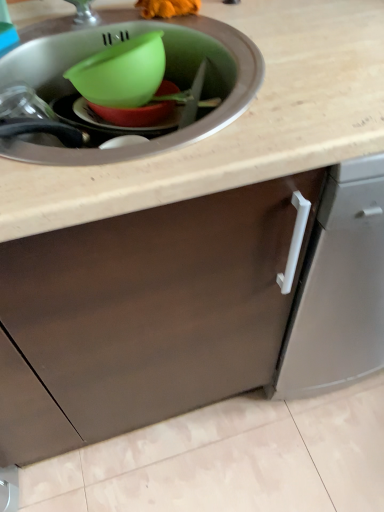
Describe the element at coordinates (135, 114) in the screenshot. I see `green plastic bowl at center` at that location.

Locate an element on the screen. This screenshot has width=384, height=512. green plastic bowl at center is located at coordinates (135, 114).

Find the location of a particular element. The height and width of the screenshot is (512, 384). matte green plastic sink at upper left is located at coordinates (166, 76).

In order to face matte green plastic sink at upper left, should I rotate leftwards or rightwards?

Rotate your view left by about 9.025°.

What do you see at coordinates (166, 76) in the screenshot? I see `matte green plastic sink at upper left` at bounding box center [166, 76].

Identify the location of green plastic bowl at center. The width and height of the screenshot is (384, 512). (135, 114).

Can you confirm if green plastic bowl at center is positioned to the left of matte green plastic sink at upper left?

No.

In the scene shown: Which object is closer to the camera taking this photo, green plastic bowl at center or matte green plastic sink at upper left?

Positioned in front is matte green plastic sink at upper left.

Does point (164, 93) come farther from viewer compared to point (28, 38)?

Yes, point (164, 93) is behind point (28, 38).

From the image's perspective, between green plastic bowl at center and matte green plastic sink at upper left, which one is located above?

From the image's view, green plastic bowl at center is above.

From a real-world perspective, is green plastic bowl at center located beneath matte green plastic sink at upper left?

Yes, from a real-world perspective, green plastic bowl at center is under matte green plastic sink at upper left.

Is green plastic bowl at center wider than matte green plastic sink at upper left?

No.

Who is taller, green plastic bowl at center or matte green plastic sink at upper left?

matte green plastic sink at upper left is taller.

Considering the sizes of objects green plastic bowl at center and matte green plastic sink at upper left in the image provided, who is bigger, green plastic bowl at center or matte green plastic sink at upper left?

Bigger between the two is matte green plastic sink at upper left.

Can we say green plastic bowl at center lies outside matte green plastic sink at upper left?

Actually, green plastic bowl at center is at least partially inside matte green plastic sink at upper left.

In the scene shown: Is green plastic bowl at center next to matte green plastic sink at upper left?

No, green plastic bowl at center is not in contact with matte green plastic sink at upper left.

Is matte green plastic sink at upper left at the back of green plastic bowl at center?

Yes, green plastic bowl at center's orientation is away from matte green plastic sink at upper left.

Measure the distance between green plastic bowl at center and matte green plastic sink at upper left.

green plastic bowl at center and matte green plastic sink at upper left are 15.02 centimeters apart.

Locate an element on the screen. basin located on the right of matte green plastic sink at upper left is located at coordinates (135, 114).

Between matte green plastic sink at upper left and green plastic bowl at center, which one appears on the right side from the viewer's perspective?

green plastic bowl at center is more to the right.

Is the depth of matte green plastic sink at upper left less than that of green plastic bowl at center?

Yes, it is in front of green plastic bowl at center.

Considering the positions of points (211, 88) and (146, 124), is point (211, 88) closer to camera compared to point (146, 124)?

That is False.

From the image's perspective, is matte green plastic sink at upper left on top of green plastic bowl at center?

Actually, matte green plastic sink at upper left appears below green plastic bowl at center in the image.

From a real-world perspective, who is located lower, matte green plastic sink at upper left or green plastic bowl at center?

green plastic bowl at center, from a real-world perspective.

Considering the sizes of objects matte green plastic sink at upper left and green plastic bowl at center in the image provided, who is thinner, matte green plastic sink at upper left or green plastic bowl at center?

Thinner between the two is green plastic bowl at center.

Is matte green plastic sink at upper left taller than green plastic bowl at center?

Correct, matte green plastic sink at upper left is much taller as green plastic bowl at center.

Who is bigger, matte green plastic sink at upper left or green plastic bowl at center?

matte green plastic sink at upper left is bigger.

Would you say green plastic bowl at center is part of matte green plastic sink at upper left's contents?

That's correct, green plastic bowl at center is inside matte green plastic sink at upper left.

Is matte green plastic sink at upper left not close to green plastic bowl at center?

No, matte green plastic sink at upper left is in close proximity to green plastic bowl at center.

Is green plastic bowl at center at the back of matte green plastic sink at upper left?

matte green plastic sink at upper left does not have its back to green plastic bowl at center.

Can you tell me how much matte green plastic sink at upper left and green plastic bowl at center differ in facing direction?

The angle between the facing direction of matte green plastic sink at upper left and the facing direction of green plastic bowl at center is 0.00242 degrees.

Identify the location of basin located on the right of matte green plastic sink at upper left. The height and width of the screenshot is (512, 384). (135, 114).

Locate an element on the screen. Image resolution: width=384 pixels, height=512 pixels. sink located on the left of green plastic bowl at center is located at coordinates (166, 76).

Where is `sink above the green plastic bowl at center (from a real-world perspective)`? The height and width of the screenshot is (512, 384). sink above the green plastic bowl at center (from a real-world perspective) is located at coordinates (166, 76).